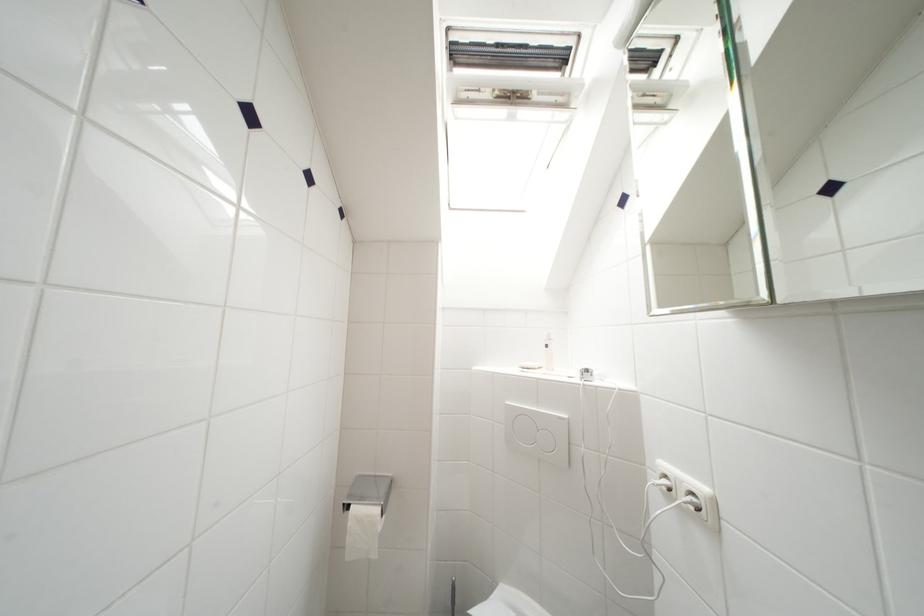
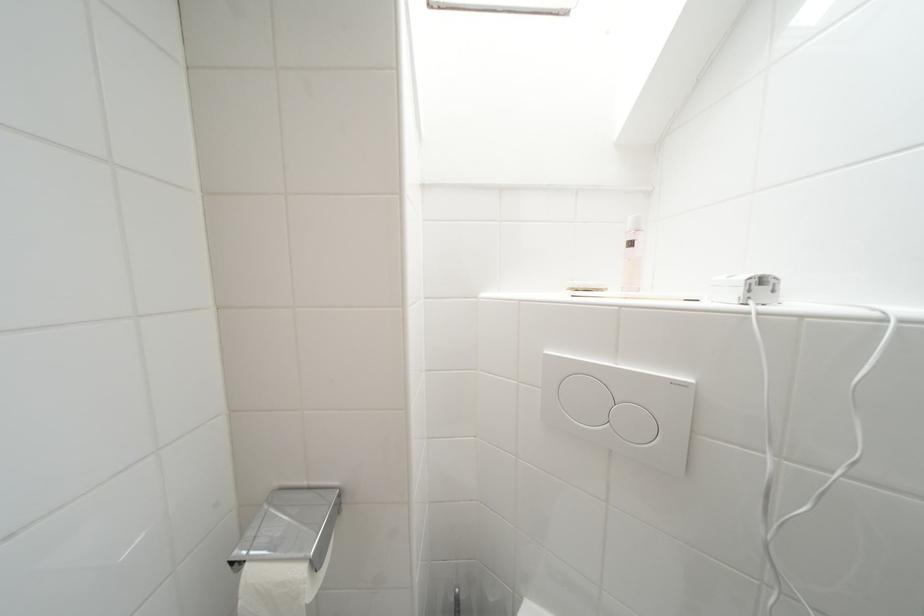
Question: Based on the continuous images, in which direction is the camera rotating? Reply with the corresponding letter.

Choices:
 (A) Left
 (B) Right
 (C) Up
 (D) Down

Answer: (D)